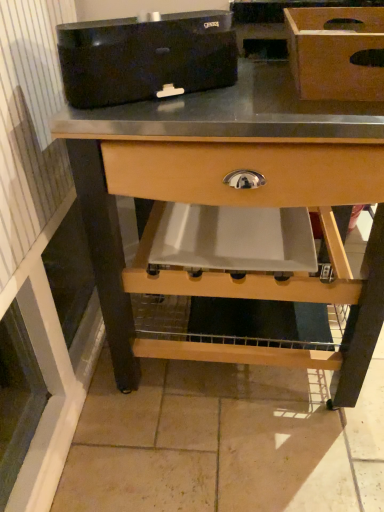
Question: Considering the relative positions of wooden box at upper right and natural wood table at center in the image provided, is wooden box at upper right to the right of natural wood table at center from the viewer's perspective?

Choices:
 (A) no
 (B) yes

Answer: (B)

Question: Does wooden box at upper right have a lesser width compared to natural wood table at center?

Choices:
 (A) no
 (B) yes

Answer: (B)

Question: From the image's perspective, is wooden box at upper right located above natural wood table at center?

Choices:
 (A) yes
 (B) no

Answer: (A)

Question: From the image's perspective, is wooden box at upper right below natural wood table at center?

Choices:
 (A) yes
 (B) no

Answer: (B)

Question: From a real-world perspective, is wooden box at upper right located beneath natural wood table at center?

Choices:
 (A) no
 (B) yes

Answer: (A)

Question: Looking at their shapes, would you say black plastic toaster at upper center is wider or thinner than natural wood table at center?

Choices:
 (A) wide
 (B) thin

Answer: (B)

Question: Relative to natural wood table at center, is black plastic toaster at upper center in front or behind?

Choices:
 (A) front
 (B) behind

Answer: (A)

Question: From a real-world perspective, relative to natural wood table at center, is black plastic toaster at upper center vertically above or below?

Choices:
 (A) below
 (B) above

Answer: (B)

Question: Considering the positions of black plastic toaster at upper center and natural wood table at center in the image, is black plastic toaster at upper center bigger or smaller than natural wood table at center?

Choices:
 (A) big
 (B) small

Answer: (B)

Question: In terms of height, does wooden box at upper right look taller or shorter compared to black plastic toaster at upper center?

Choices:
 (A) short
 (B) tall

Answer: (A)

Question: Does point [370, 74] appear closer or farther from the camera than point [205, 60]?

Choices:
 (A) farther
 (B) closer

Answer: (B)

Question: Is wooden box at upper right in front of or behind black plastic toaster at upper center in the image?

Choices:
 (A) front
 (B) behind

Answer: (B)

Question: Looking at their shapes, would you say wooden box at upper right is wider or thinner than black plastic toaster at upper center?

Choices:
 (A) thin
 (B) wide

Answer: (B)

Question: Looking at the image, does wooden box at upper right seem bigger or smaller compared to natural wood table at center?

Choices:
 (A) small
 (B) big

Answer: (A)

Question: In terms of width, does wooden box at upper right look wider or thinner when compared to natural wood table at center?

Choices:
 (A) thin
 (B) wide

Answer: (A)